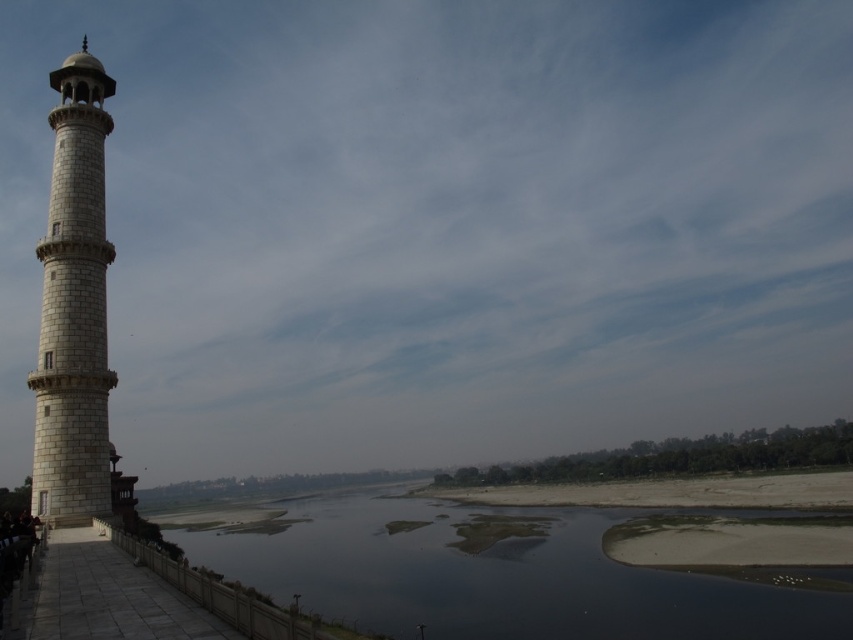
You are standing on the riverside path and want to take a photo of the white stone tower at left and the dark water at lower center. If you want to include both in your photo frame, which direction should you move to ensure both are visible?

You should move to the right of the white stone tower at left so that the dark water at lower center comes into view to its right side.

You are standing at the point marked as point (x=491, y=573) in the image. What is the nearest object to you in the scene?

The nearest object to point (x=491, y=573) is the dark water at lower center, as the point is located on it.